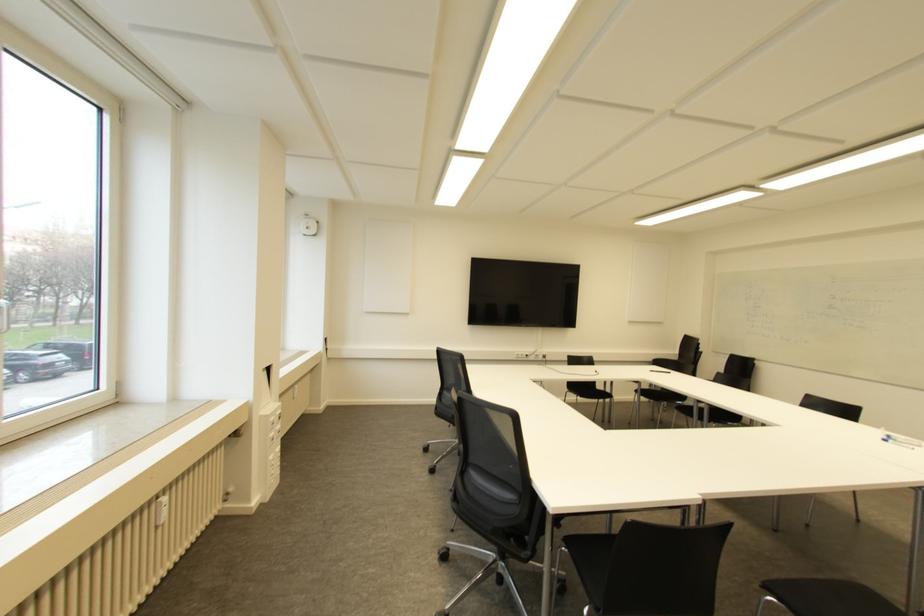
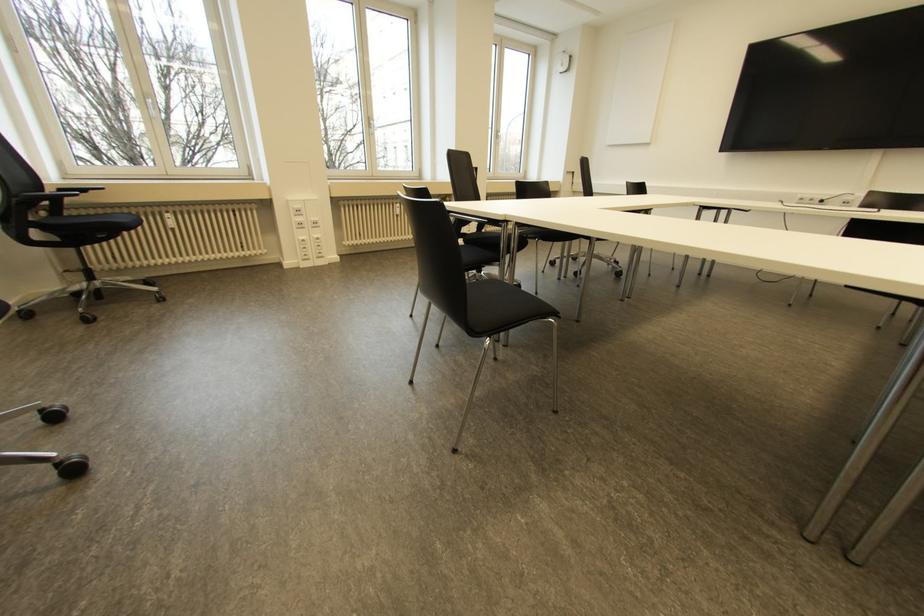
Where in the second image is the point corresponding to [163,499] from the first image?

(397, 204)